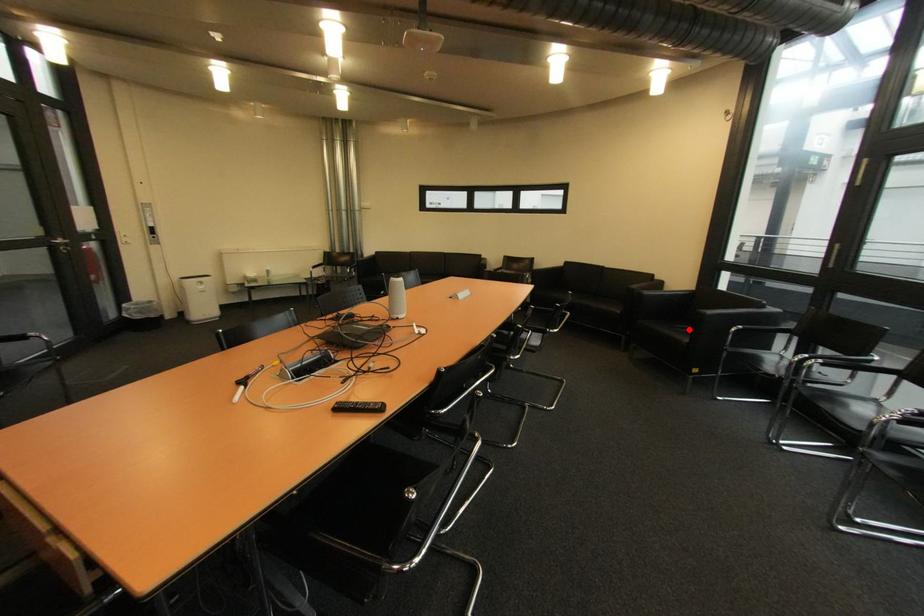
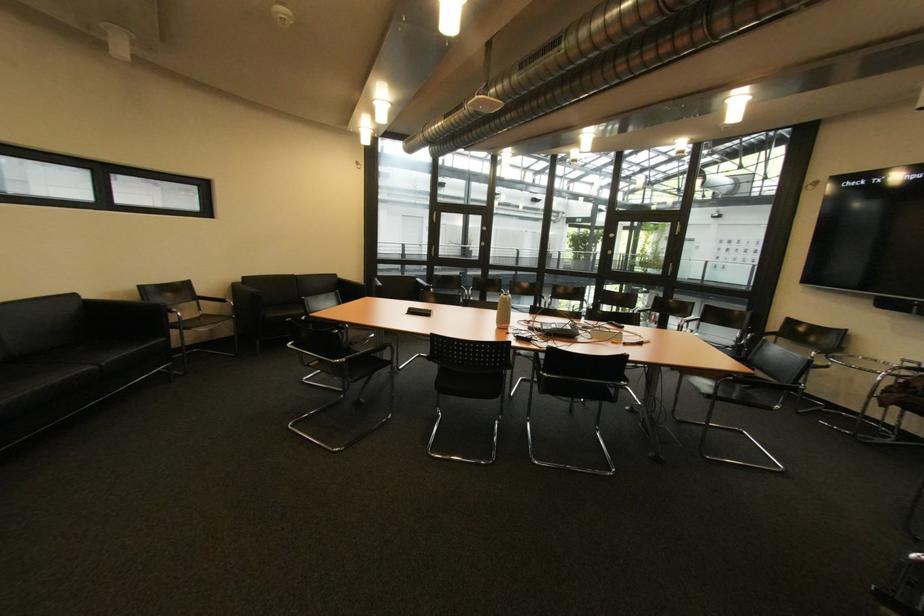
Question: I am providing you with two images of the same scene from different viewpoints. A red point is marked on the first image. Can you still see the location of the red point in image 2?

Choices:
 (A) Yes
 (B) No

Answer: (B)